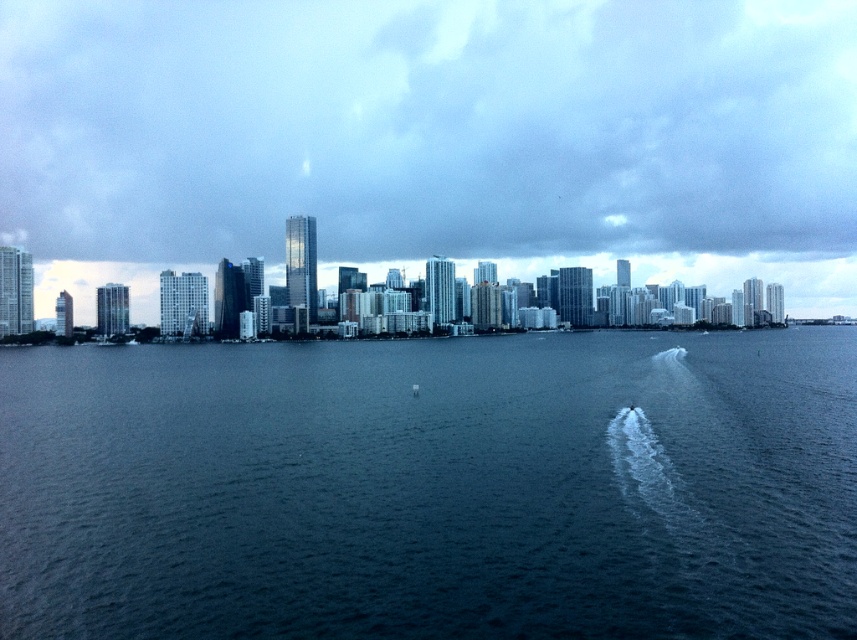
Question: In this image, where is dark blue water at center located relative to cloudy sky at upper center?

Choices:
 (A) left
 (B) right

Answer: (A)

Question: Which object appears farthest from the camera in this image?

Choices:
 (A) dark blue water at center
 (B) cloudy sky at upper center

Answer: (B)

Question: Is dark blue water at center smaller than cloudy sky at upper center?

Choices:
 (A) no
 (B) yes

Answer: (B)

Question: Which point is farther to the camera?

Choices:
 (A) (732, 353)
 (B) (216, 227)

Answer: (B)

Question: Does dark blue water at center come in front of cloudy sky at upper center?

Choices:
 (A) no
 (B) yes

Answer: (B)